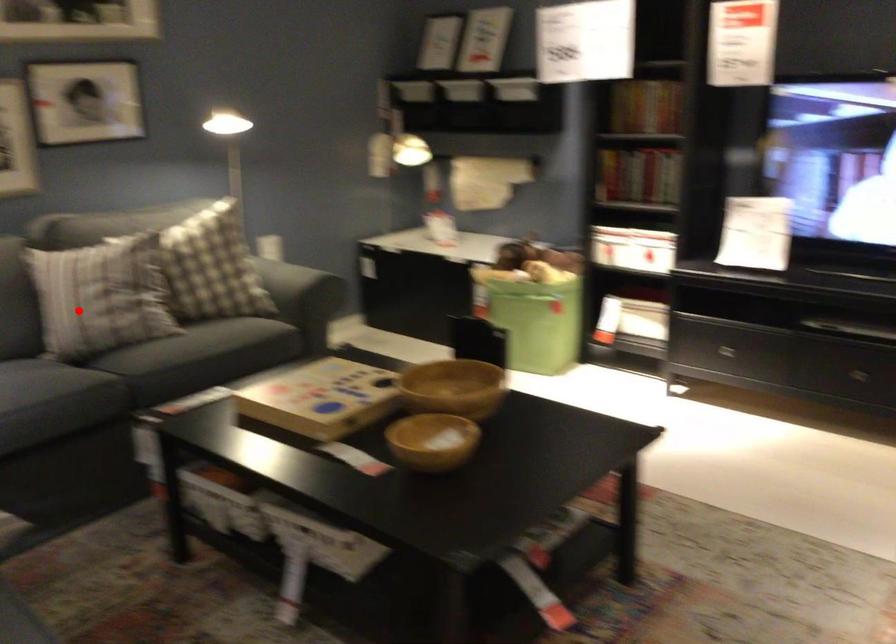
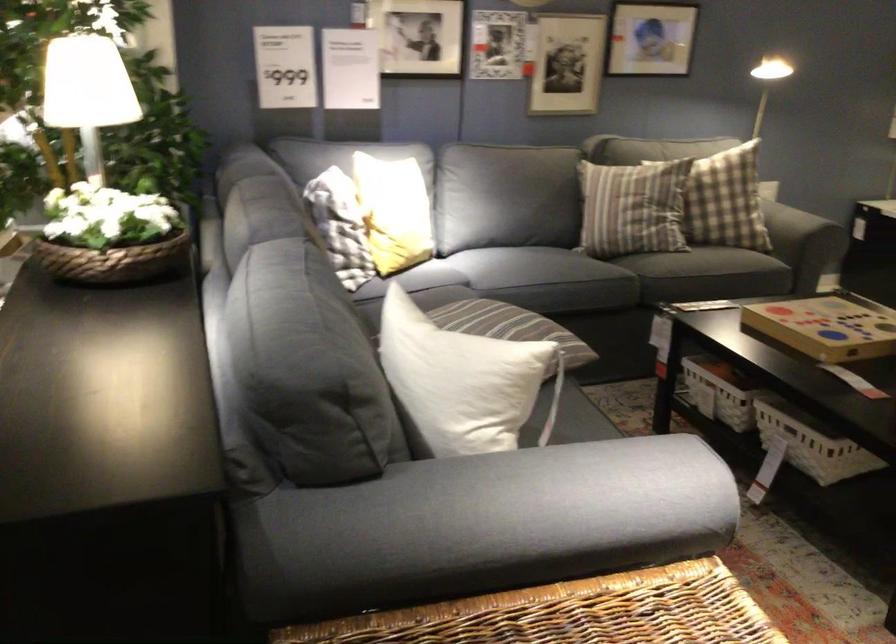
Question: I am providing you with two images of the same scene from different viewpoints. Image1 has a red point marked. In image2, the corresponding 3D location appears at what relative position? Reply with the corresponding letter.

Choices:
 (A) Closer
 (B) Farther

Answer: (B)